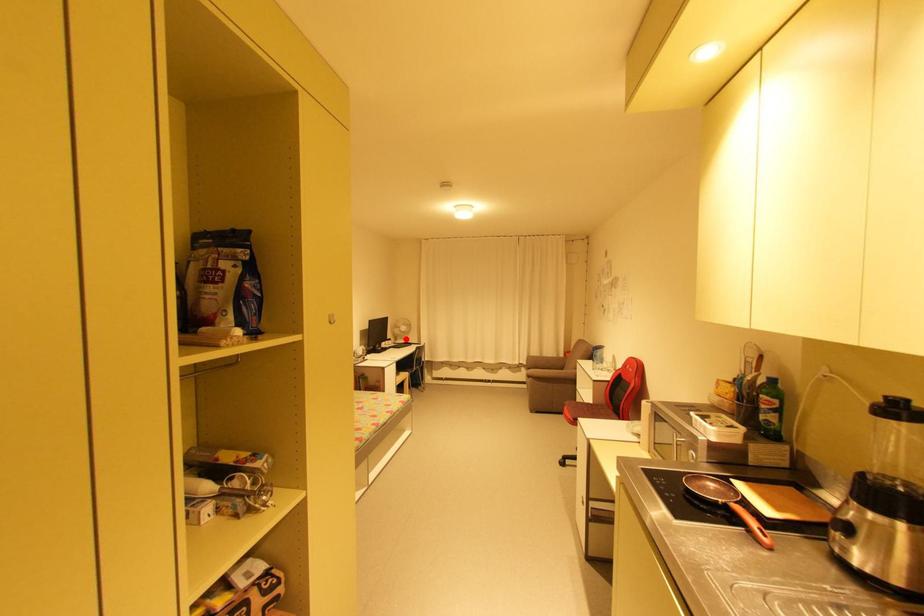
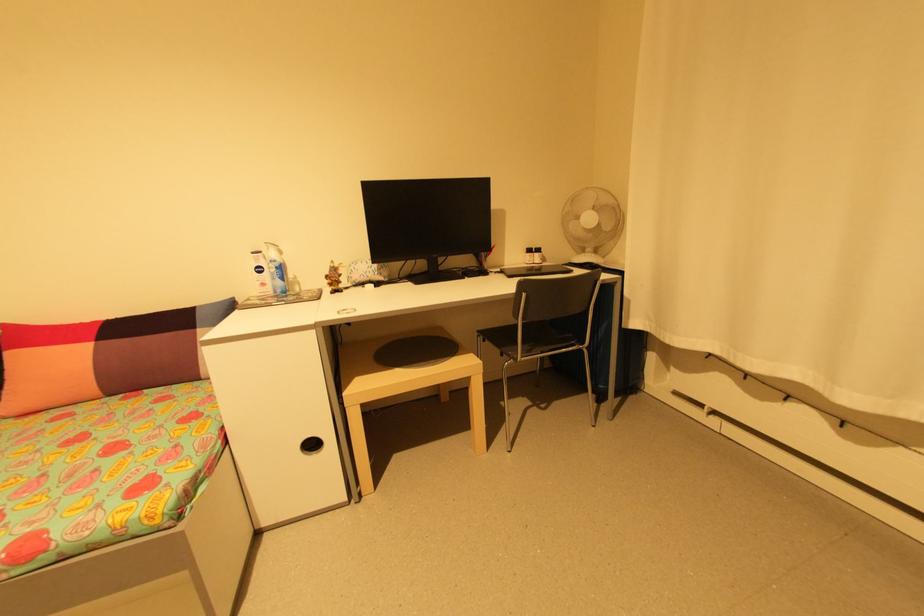
Where in the second image is the point corresponding to the highlighted location from the first image?

(600, 252)